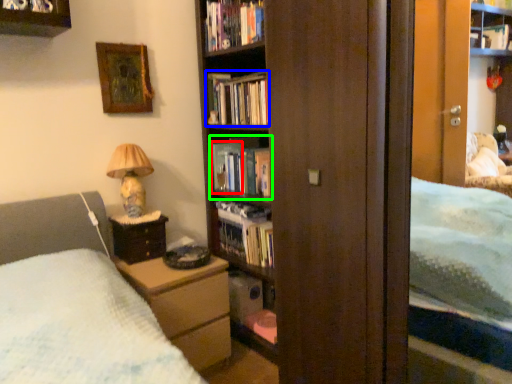
Question: Based on their relative distances, which object is nearer to paperback book (highlighted by a red box)? Choose from book (highlighted by a blue box) and book (highlighted by a green box).

Choices:
 (A) book
 (B) book

Answer: (B)